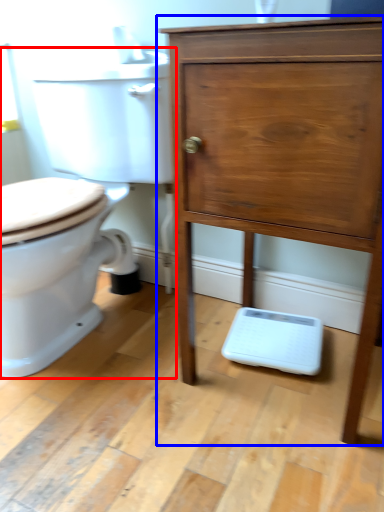
Question: Among these objects, which one is nearest to the camera, toilet (highlighted by a red box) or chest of drawers (highlighted by a blue box)?

Choices:
 (A) toilet
 (B) chest of drawers

Answer: (B)